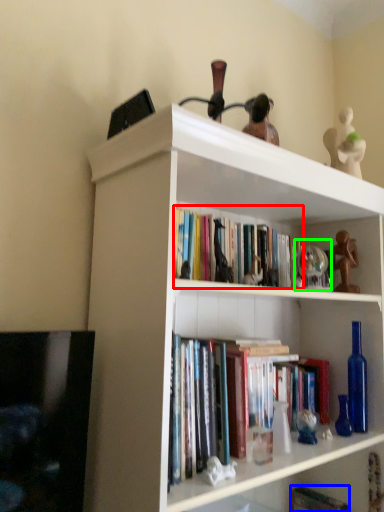
Question: Which object is positioned farthest from book (highlighted by a red box)? Select from paperback book (highlighted by a blue box) and toy (highlighted by a green box).

Choices:
 (A) paperback book
 (B) toy

Answer: (A)